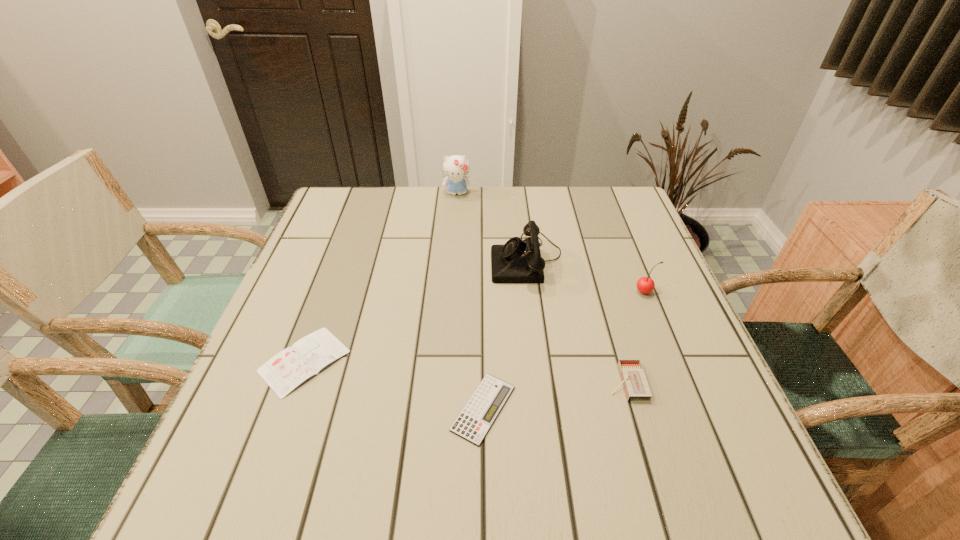
In order to click on the farthest object in this screenshot , I will do `click(456, 167)`.

At what (x,y) coordinates should I click in order to perform the action: click on the tallest object. Please return your answer as a coordinate pair (x, y). Looking at the image, I should click on (456, 167).

The height and width of the screenshot is (540, 960). I want to click on the fifth shortest object, so click(x=517, y=261).

Locate an element on the screen. This screenshot has width=960, height=540. the rightmost object is located at coordinates (645, 285).

At what (x,y) coordinates should I click in order to perform the action: click on cherry. Please return your answer as a coordinate pair (x, y). The image size is (960, 540). Looking at the image, I should click on (645, 285).

The width and height of the screenshot is (960, 540). I want to click on the third shortest object, so click(x=634, y=381).

This screenshot has width=960, height=540. In order to click on the fifth object from left to right in this screenshot , I will do `click(634, 381)`.

Where is `the second shortest object`? This screenshot has width=960, height=540. the second shortest object is located at coordinates (292, 366).

Where is `the leftmost object`? the leftmost object is located at coordinates (292, 366).

What are the coordinates of `the shortest object` in the screenshot? It's located at (473, 423).